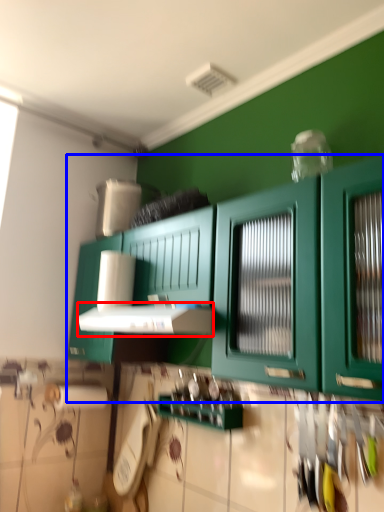
Question: Among these objects, which one is farthest to the camera, vent (highlighted by a red box) or cabinetry (highlighted by a blue box)?

Choices:
 (A) vent
 (B) cabinetry

Answer: (A)